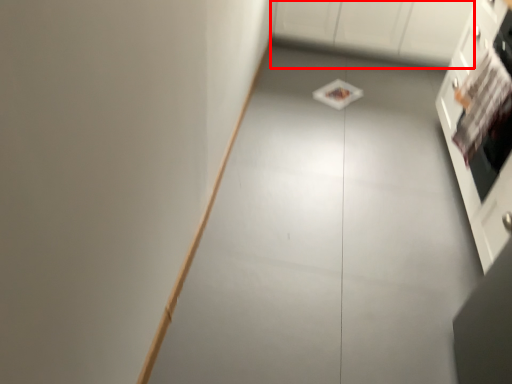
Question: From the image's perspective, where is cabinetry (annotated by the red box) located relative to cabinetry?

Choices:
 (A) above
 (B) below

Answer: (A)